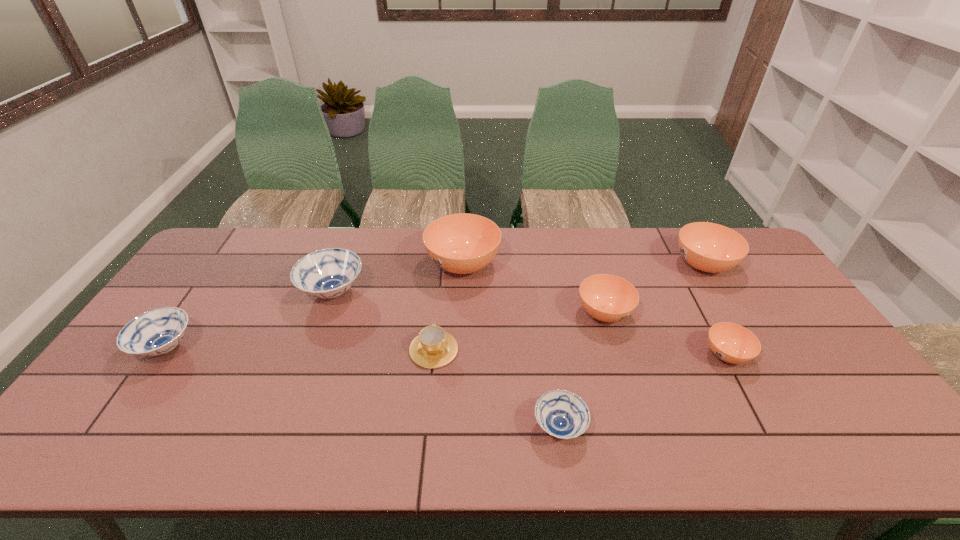
Select which soup bowl is the closest to the nearest blue soup bowl. Please provide its 2D coordinates. Your answer should be formatted as a tuple, i.e. [(x, y)], where the tuple contains the x and y coordinates of a point satisfying the conditions above.

[(608, 298)]

Identify which soup bowl is located as the nearest to the cup. Please provide its 2D coordinates. Your answer should be formatted as a tuple, i.e. [(x, y)], where the tuple contains the x and y coordinates of a point satisfying the conditions above.

[(328, 273)]

Find the location of a particular element. the second closest peach soup bowl relative to the brown cup is located at coordinates (608, 298).

The height and width of the screenshot is (540, 960). What are the coordinates of `peach soup bowl that is the fourth closest one to the farthest blue soup bowl` in the screenshot? It's located at (709, 247).

Select which blue soup bowl appears as the closest to the farthest blue soup bowl. Please provide its 2D coordinates. Your answer should be formatted as a tuple, i.e. [(x, y)], where the tuple contains the x and y coordinates of a point satisfying the conditions above.

[(156, 332)]

Select which blue soup bowl appears as the third closest to the tallest object. Please provide its 2D coordinates. Your answer should be formatted as a tuple, i.e. [(x, y)], where the tuple contains the x and y coordinates of a point satisfying the conditions above.

[(156, 332)]

Find the location of a particular element. vacant space that satisfies the following two spatial constraints: 1. with the handle on the side of the second peach soup bowl from left to right; 2. on the right side of the brown cup is located at coordinates (438, 313).

What are the coordinates of `vacant position in the image that satisfies the following two spatial constraints: 1. on the front side of the leftmost blue soup bowl; 2. on the right side of the nearest object` in the screenshot? It's located at [x=111, y=427].